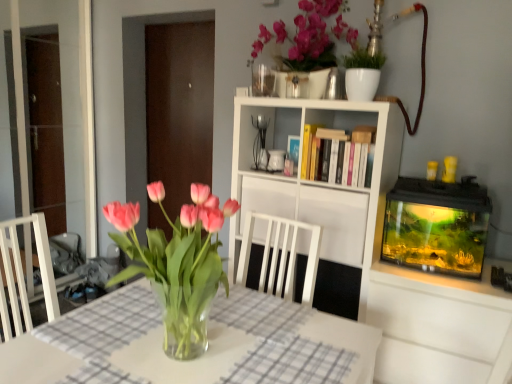
This screenshot has width=512, height=384. I want to click on free spot below pink glass vase at center (from a real-world perspective), so click(x=184, y=352).